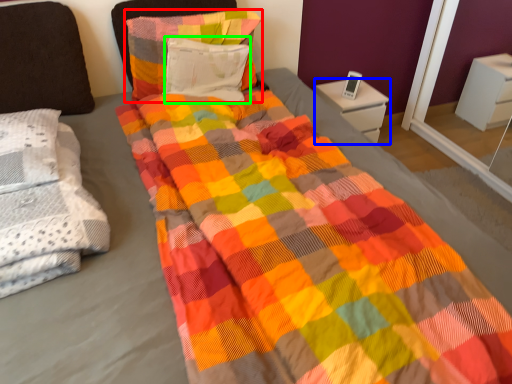
Question: Which object is the farthest from pillow (highlighted by a red box)? Choose among these: nightstand (highlighted by a blue box) or pillow (highlighted by a green box).

Choices:
 (A) nightstand
 (B) pillow

Answer: (A)